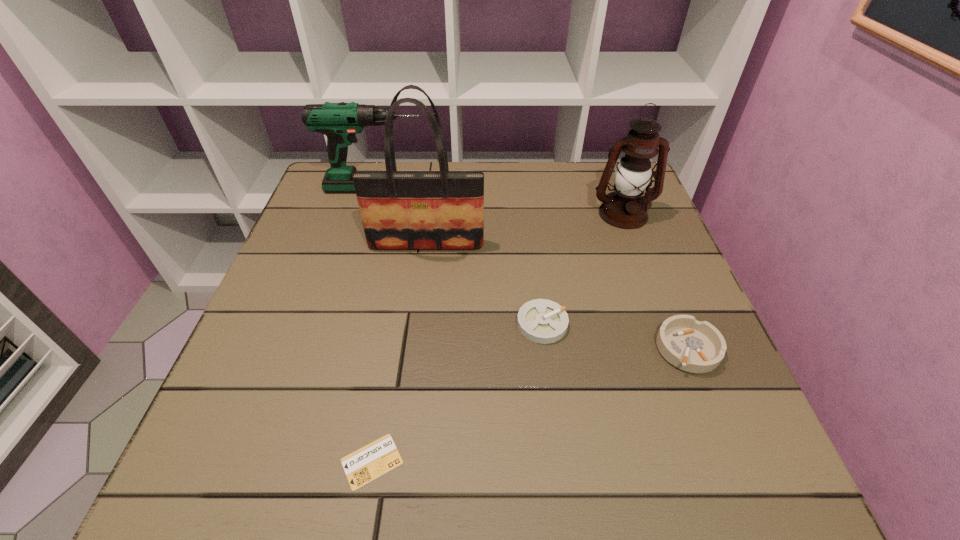
The height and width of the screenshot is (540, 960). I want to click on shopping bag, so click(400, 210).

At what (x,y) coordinates should I click in order to perform the action: click on the third farthest object. Please return your answer as a coordinate pair (x, y). The height and width of the screenshot is (540, 960). Looking at the image, I should click on (400, 210).

Locate an element on the screen. the second farthest object is located at coordinates (625, 208).

The image size is (960, 540). I want to click on lantern, so click(625, 208).

Identify the location of the farthest object. (340, 122).

You are a GUI agent. You are given a task and a screenshot of the screen. Output one action in this format:
    pyautogui.click(x=<x>, y=<y>)
    Task: Click on the fourth shortest object
    The width and height of the screenshot is (960, 540).
    Given the screenshot: What is the action you would take?
    pyautogui.click(x=340, y=122)

Where is `the taller ashtray`? the taller ashtray is located at coordinates pyautogui.click(x=698, y=347).

Find the location of `the right ashtray`. the right ashtray is located at coordinates (698, 347).

Identify the location of the second shortest object. pyautogui.click(x=543, y=321).

You are a GUI agent. You are given a task and a screenshot of the screen. Output one action in this format:
    pyautogui.click(x=<x>, y=<y>)
    Task: Click on the left ashtray
    This screenshot has width=960, height=540.
    Given the screenshot: What is the action you would take?
    pyautogui.click(x=543, y=321)